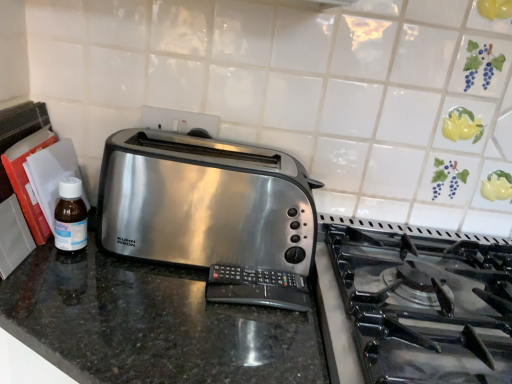
Question: From a real-world perspective, is shiny granite counter at center positioned above or below satin metallic toaster at center?

Choices:
 (A) above
 (B) below

Answer: (B)

Question: Considering the positions of point (0, 299) and point (215, 182), is point (0, 299) closer or farther from the camera than point (215, 182)?

Choices:
 (A) farther
 (B) closer

Answer: (B)

Question: Which object is positioned farthest from the satin metallic toaster at center?

Choices:
 (A) shiny granite counter at center
 (B) translucent plastic bottle at left

Answer: (B)

Question: Which object is the farthest from the satin metallic toaster at center?

Choices:
 (A) shiny granite counter at center
 (B) translucent plastic bottle at left

Answer: (B)